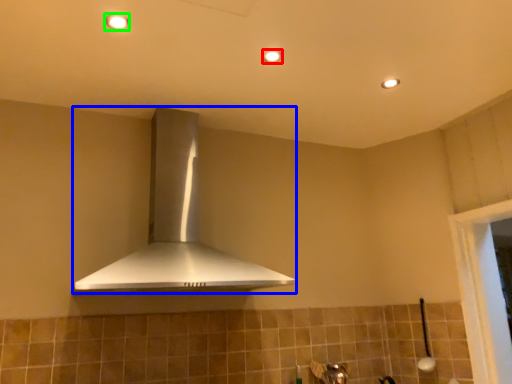
Question: Considering the real-world distances, which object is farthest from light fixture (highlighted by a red box)? home appliance (highlighted by a blue box) or light fixture (highlighted by a green box)?

Choices:
 (A) home appliance
 (B) light fixture

Answer: (A)